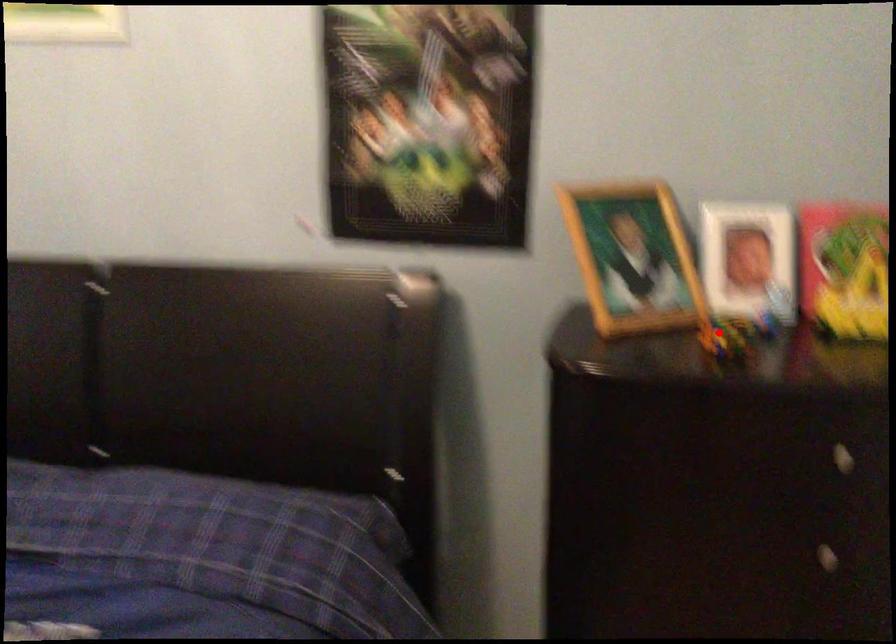
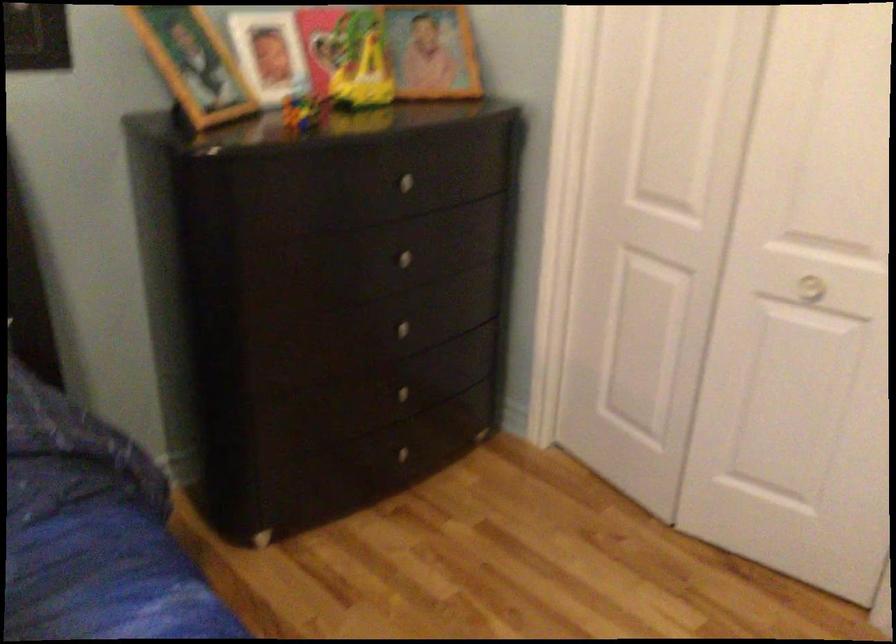
Question: I am providing you with two images of the same scene from different viewpoints. Given a red point in image1, look at the same physical point in image2. Is it:

Choices:
 (A) Closer to the viewpoint
 (B) Farther from the viewpoint

Answer: (B)